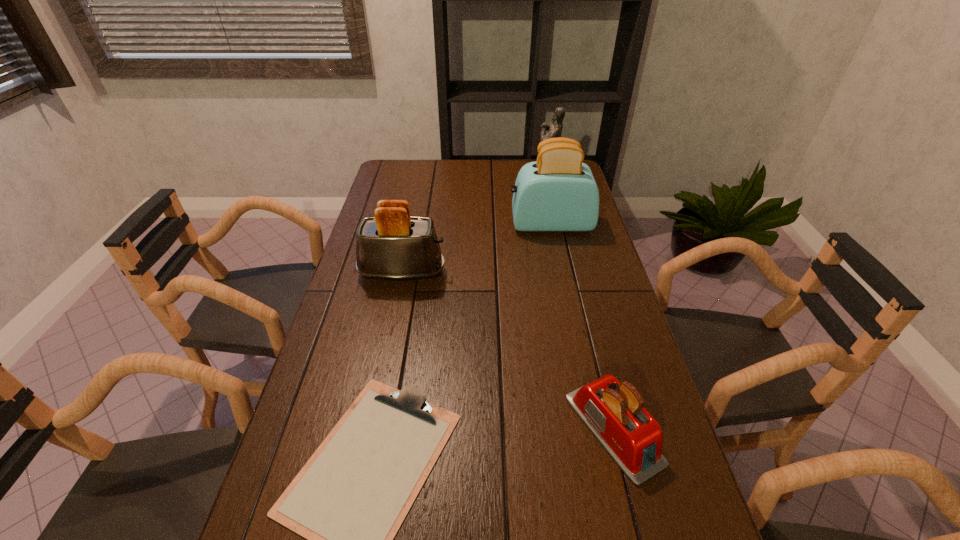
Find the location of a particular element. The width and height of the screenshot is (960, 540). vacant region located on the front-facing side of the figurine is located at coordinates (441, 179).

Where is `vacant space located 0.070m on the front-facing side of the figurine`? vacant space located 0.070m on the front-facing side of the figurine is located at coordinates (517, 179).

What are the coordinates of `vacant space located on the front-facing side of the figurine` in the screenshot? It's located at (491, 179).

Where is `vacant space located on the side of the second tallest toaster with the control lever`? The image size is (960, 540). vacant space located on the side of the second tallest toaster with the control lever is located at coordinates (511, 273).

This screenshot has width=960, height=540. What are the coordinates of `vacant area situated 0.280m on the back of the shortest toaster` in the screenshot? It's located at (582, 301).

I want to click on object present at the far edge, so click(x=554, y=129).

The height and width of the screenshot is (540, 960). I want to click on object that is at the left edge, so click(x=393, y=245).

You are a GUI agent. You are given a task and a screenshot of the screen. Output one action in this format:
    pyautogui.click(x=<x>, y=<y>)
    Task: Click on the figurine that is at the right edge
    Image resolution: width=960 pixels, height=540 pixels.
    Given the screenshot: What is the action you would take?
    pyautogui.click(x=554, y=129)

At what (x,y) coordinates should I click in order to perform the action: click on object that is positioned at the far right corner. Please return your answer as a coordinate pair (x, y). The width and height of the screenshot is (960, 540). Looking at the image, I should click on click(x=554, y=129).

Find the location of a particular element. vacant region at the far edge of the desktop is located at coordinates (427, 177).